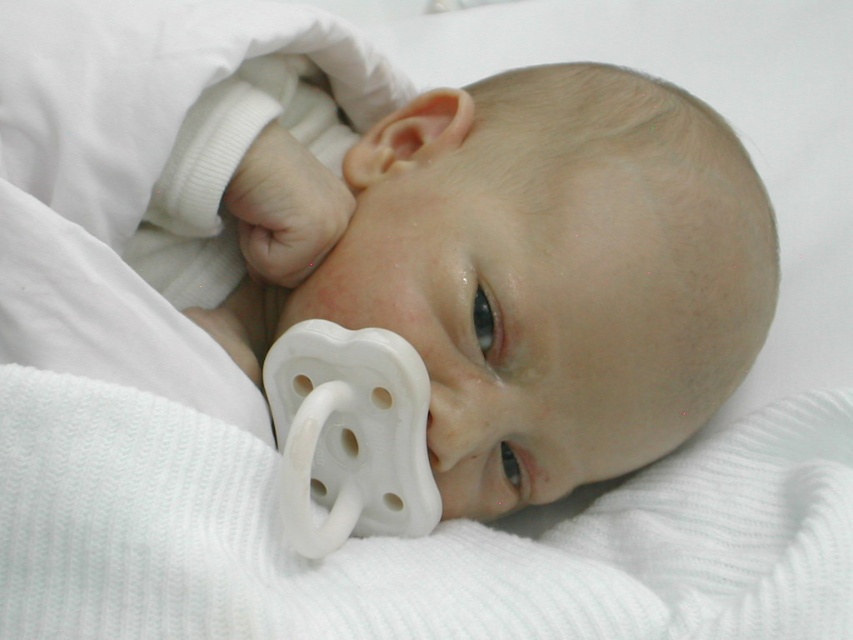
Question: Does white ribbed blanket at center appear over white rubber pacifier at center?

Choices:
 (A) yes
 (B) no

Answer: (B)

Question: Can you confirm if white ribbed blanket at center is positioned below white rubber pacifier at center?

Choices:
 (A) yes
 (B) no

Answer: (A)

Question: Which of the following is the farthest from the observer?

Choices:
 (A) (430, 454)
 (B) (247, 456)

Answer: (A)

Question: Among these points, which one is nearest to the camera?

Choices:
 (A) (711, 564)
 (B) (432, 467)

Answer: (A)

Question: Which of the following is the farthest from the observer?

Choices:
 (A) white ribbed blanket at center
 (B) white rubber pacifier at center

Answer: (B)

Question: Is white ribbed blanket at center above white rubber pacifier at center?

Choices:
 (A) yes
 (B) no

Answer: (B)